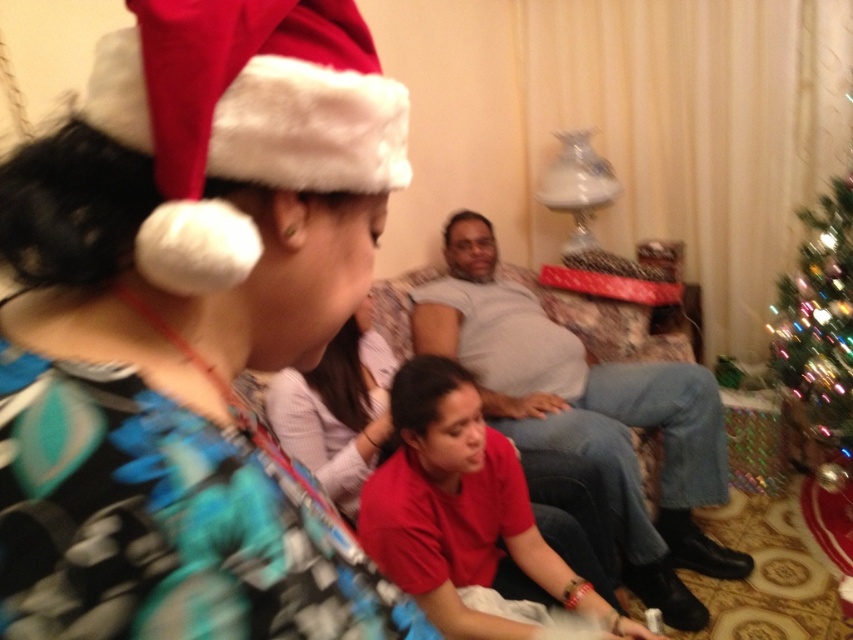
You are a delivery person who needs to place a small package between the green glittering christmas tree at right and the matte pink sweater at center. Can you fit the package there if it requires at least 1.6 meters of space?

The distance between the green glittering christmas tree at right and the matte pink sweater at center is 1.56 meters, which is slightly less than the required 1.6 meters. Therefore, the package cannot be placed there.

Looking at this image, you are a guest at a holiday party and want to take a photo of the matte pink sweater at center without the green glittering christmas tree at right appearing in the shot. How can you adjust your position to achieve this?

Move forward so that the matte pink sweater at center comes into view while the green glittering christmas tree at right is out of frame.

Looking at this image, you are a photographer setting up for a holiday photo shoot. You need to ensure that the red velvet santa hat at upper left and the matte pink sweater at center are both visible in the frame. Based on their sizes, which object should you focus on first to ensure proper framing?

The red velvet santa hat at upper left has a lesser height compared to the matte pink sweater at center, so you should focus on the matte pink sweater at center first to ensure it fits within the frame properly before adjusting for the smaller hat.